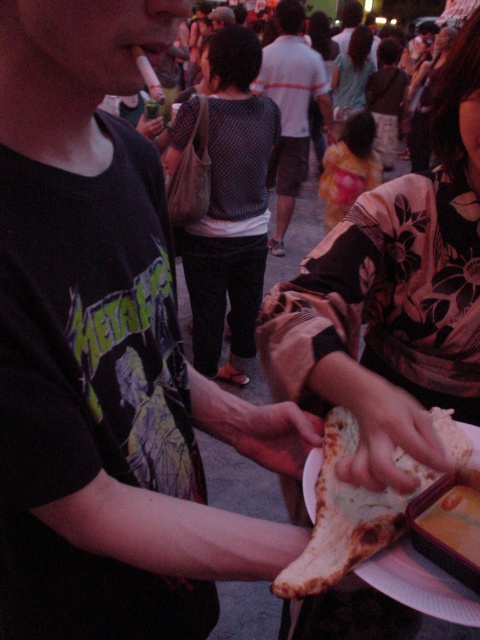
Is the position of fluffy yellow hair at center less distant than that of floral fabric dress at center?

That is True.

Which is behind, point (368, 177) or point (360, 104)?

The point (360, 104) is behind.

Where is `fluffy yellow hair at center`? The height and width of the screenshot is (640, 480). fluffy yellow hair at center is located at coordinates (348, 168).

Consider the image. Does fluffy yellow hair at center have a larger size compared to matte black hand at center?

Indeed, fluffy yellow hair at center has a larger size compared to matte black hand at center.

Is point (343, 172) behind point (137, 122)?

Yes, it is.

Identify the location of fluffy yellow hair at center. The width and height of the screenshot is (480, 640). (348, 168).

At what (x,y) coordinates should I click in order to perform the action: click on fluffy yellow hair at center. Please return your answer as a coordinate pair (x, y). Looking at the image, I should click on (348, 168).

Does polka dot blouse at center have a larger size compared to brown leather hand at center?

Yes, polka dot blouse at center is bigger than brown leather hand at center.

Consider the image. Who is more distant from viewer, (254, 148) or (250, 440)?

Positioned behind is point (254, 148).

Does point (224, 278) lie behind point (321, 432)?

Yes, it is.

The height and width of the screenshot is (640, 480). In order to click on polka dot blouse at center in this screenshot , I will do `click(230, 209)`.